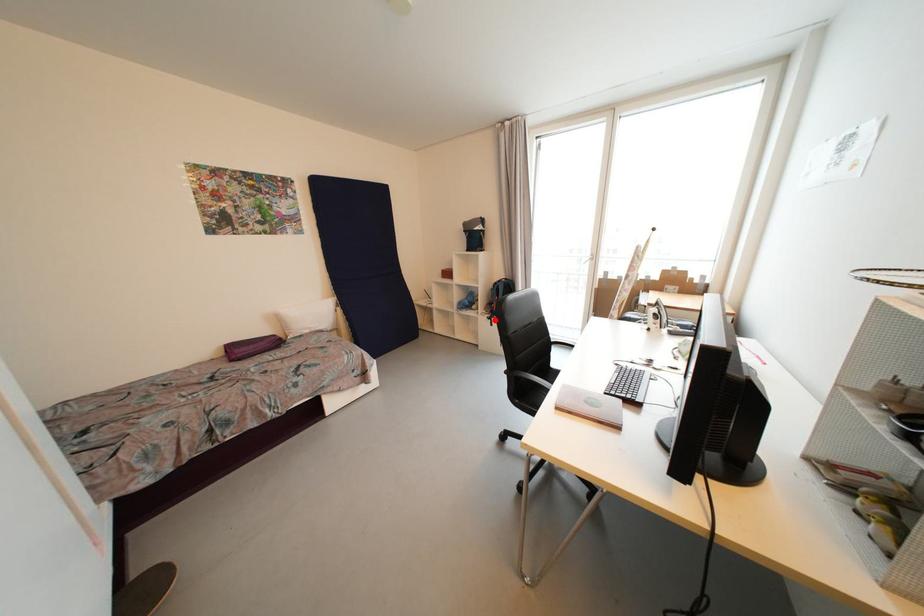
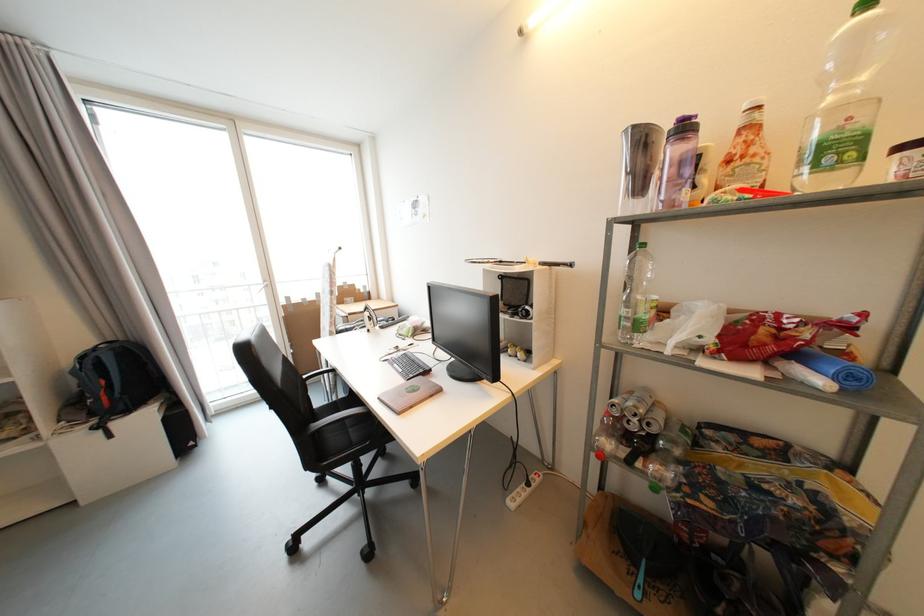
The point at the highlighted location is marked in the first image. Where is the corresponding point in the second image?

(104, 429)